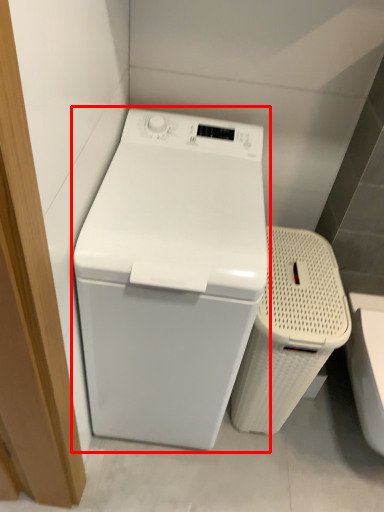
Question: From the image, what is the correct spatial relationship of washing machine (annotated by the red box) in relation to laundry basket?

Choices:
 (A) left
 (B) right

Answer: (A)